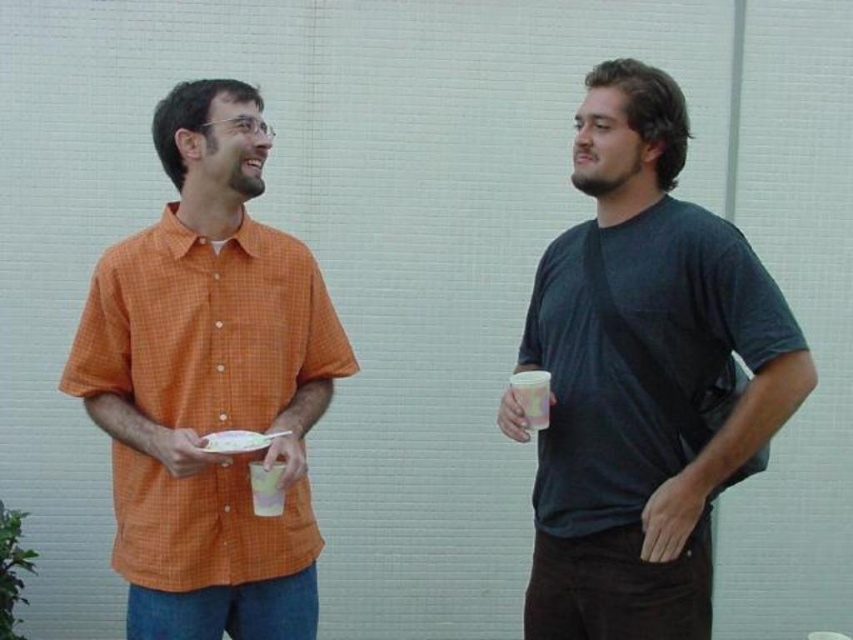
Question: Is matte black t-shirt at right below translucent plastic cup at center?

Choices:
 (A) no
 (B) yes

Answer: (A)

Question: Which object appears farthest from the camera in this image?

Choices:
 (A) matte black t-shirt at right
 (B) orange checkered shirt at left

Answer: (B)

Question: Among these points, which one is farthest from the camera?

Choices:
 (A) (264, 480)
 (B) (234, 88)

Answer: (B)

Question: Which object is the farthest from the translucent plastic cup at center?

Choices:
 (A) matte black t-shirt at right
 (B) orange checkered shirt at left

Answer: (A)

Question: Considering the relative positions of matte black t-shirt at right and translucent plastic cup at center in the image provided, where is matte black t-shirt at right located with respect to translucent plastic cup at center?

Choices:
 (A) left
 (B) right

Answer: (B)

Question: Does matte black t-shirt at right have a larger size compared to orange checkered shirt at left?

Choices:
 (A) no
 (B) yes

Answer: (B)